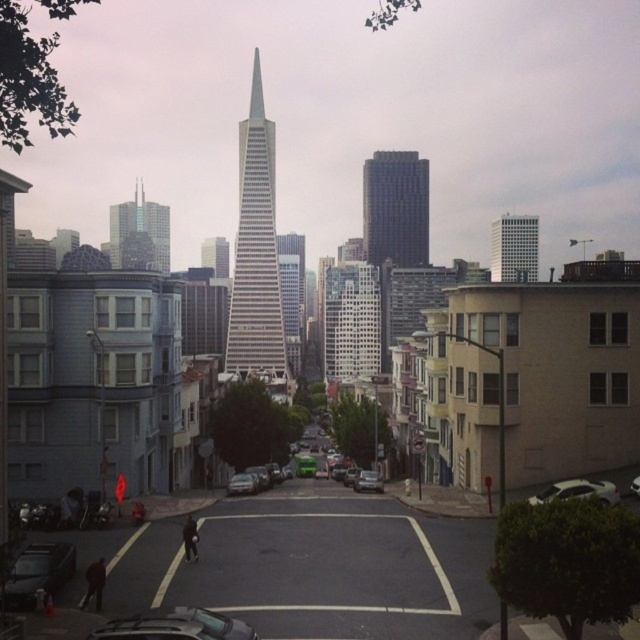
Does point (509, 218) lie in front of point (221, 266)?

Yes, point (509, 218) is in front of point (221, 266).

Does white glass building at upper right appear over glassy white skyscraper at center?

No.

At what (x,y) coordinates should I click in order to perform the action: click on white glass building at upper right. Please return your answer as a coordinate pair (x, y). Looking at the image, I should click on (515, 248).

Find the location of a particular element. white glass building at upper right is located at coordinates (515, 248).

Is shiny silver car at center positioned in front of white glass building at upper right?

Yes, shiny silver car at center is closer to the viewer.

Who is more distant from viewer, (122, 627) or (516, 278)?

The point (516, 278) is behind.

The width and height of the screenshot is (640, 640). Find the location of `shiny silver car at center`. shiny silver car at center is located at coordinates (176, 627).

Where is `silver glass skyscraper at center`? The image size is (640, 640). silver glass skyscraper at center is located at coordinates (256, 252).

In the scene shown: Can you confirm if silver glass skyscraper at center is thinner than shiny black sedan at lower left?

No, silver glass skyscraper at center is not thinner than shiny black sedan at lower left.

Identify the location of silver glass skyscraper at center. (256, 252).